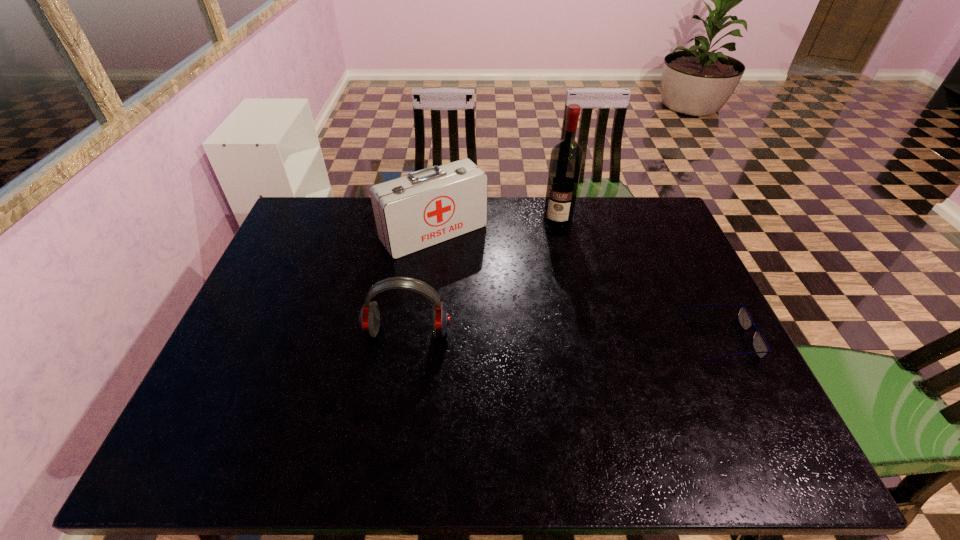
Where is `free space that is in between the third shortest object and the second object from right to left`? This screenshot has height=540, width=960. free space that is in between the third shortest object and the second object from right to left is located at coordinates (495, 227).

You are a GUI agent. You are given a task and a screenshot of the screen. Output one action in this format:
    pyautogui.click(x=<x>, y=<y>)
    Task: Click on the unoccupied area between the first-aid kit and the spectacles
    
    Given the screenshot: What is the action you would take?
    pyautogui.click(x=577, y=286)

Where is `object that stands as the third closest to the tallest object`? object that stands as the third closest to the tallest object is located at coordinates (369, 319).

Select which object is the third closest to the third shortest object. Please provide its 2D coordinates. Your answer should be formatted as a tuple, i.e. [(x, y)], where the tuple contains the x and y coordinates of a point satisfying the conditions above.

[(759, 344)]

Identify the location of free space that satisfies the following two spatial constraints: 1. on the back side of the second object from right to left; 2. on the right side of the first-aid kit. coord(436,221).

Where is `free location that satisfies the following two spatial constraints: 1. on the front side of the spectacles; 2. on the front-facing side of the second object from right to left`? The width and height of the screenshot is (960, 540). free location that satisfies the following two spatial constraints: 1. on the front side of the spectacles; 2. on the front-facing side of the second object from right to left is located at coordinates (582, 338).

In order to click on vacant space that satisfies the following two spatial constraints: 1. on the front side of the tallest object; 2. on the front-facing side of the spectacles in this screenshot , I will do `click(582, 338)`.

Find the location of a particular element. free space that satisfies the following two spatial constraints: 1. on the ear cups of the third tallest object; 2. on the front-facing side of the shortest object is located at coordinates (406, 338).